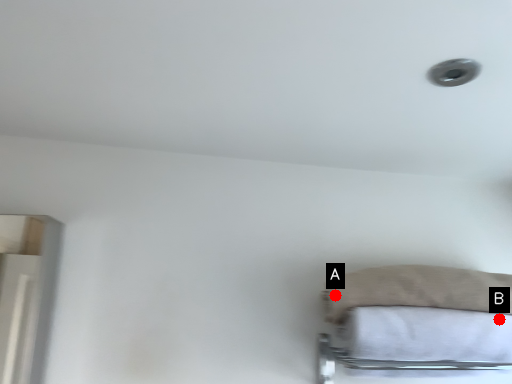
Question: Two points are circled on the image, labeled by A and B beside each circle. Among these points, which one is farthest from the camera?

Choices:
 (A) A is further
 (B) B is further

Answer: (A)